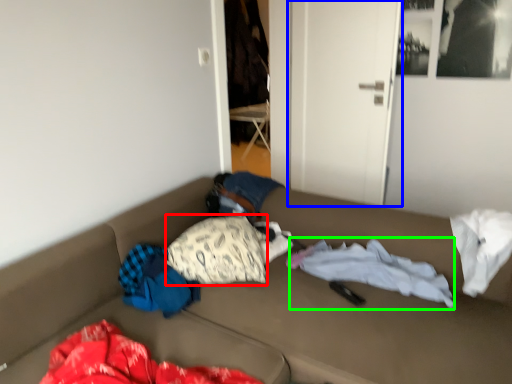
Question: Based on their relative distances, which object is nearer to pillow (highlighted by a red box)? Choose from door (highlighted by a blue box) and blanket (highlighted by a green box).

Choices:
 (A) door
 (B) blanket

Answer: (B)